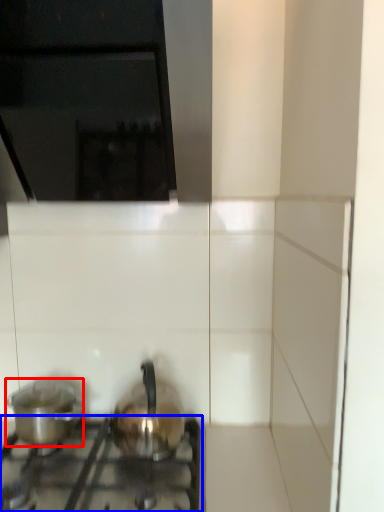
Question: Which object is further to the camera taking this photo, kitchen appliance (highlighted by a red box) or gas stove (highlighted by a blue box)?

Choices:
 (A) kitchen appliance
 (B) gas stove

Answer: (A)